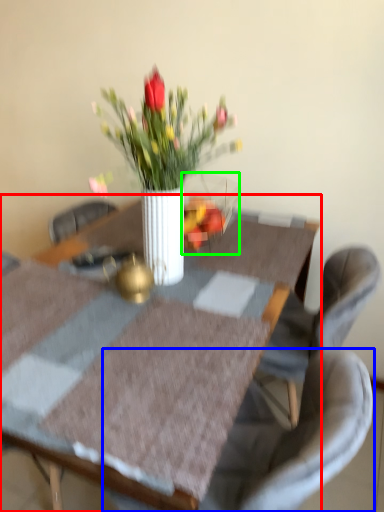
Question: Estimate the real-world distances between objects in this image. Which object is closer to table (highlighted by a red box), chair (highlighted by a blue box) or glass vase (highlighted by a green box)?

Choices:
 (A) chair
 (B) glass vase

Answer: (B)